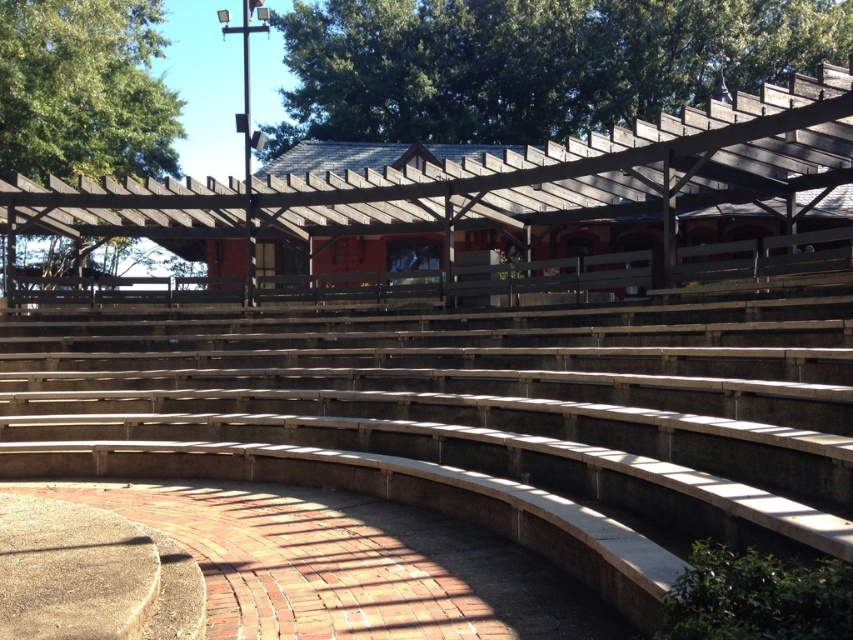
You are attending a performance at the amphitheater and want to sit in the shade. The wooden bench at center and the green leafy tree at upper center are in your view. Which object provides shade for the bench?

The green leafy tree at upper center is located above the wooden bench at center, so it provides shade for the bench.

You are planning to place a 2 meter wide sculpture between the wooden bench at center and the green leafy tree at upper left. Can the sculpture fit between them based on their sizes?

The wooden bench at center is wider than the green leafy tree at upper left, but the exact width difference isn not specified. Therefore, it is uncertain if the 2 meter wide sculpture can fit between them without more precise measurements.

You are standing at point (477, 416) in the amphitheater. What object are you standing on?

You are standing on the wooden bench at center located at point (477, 416).